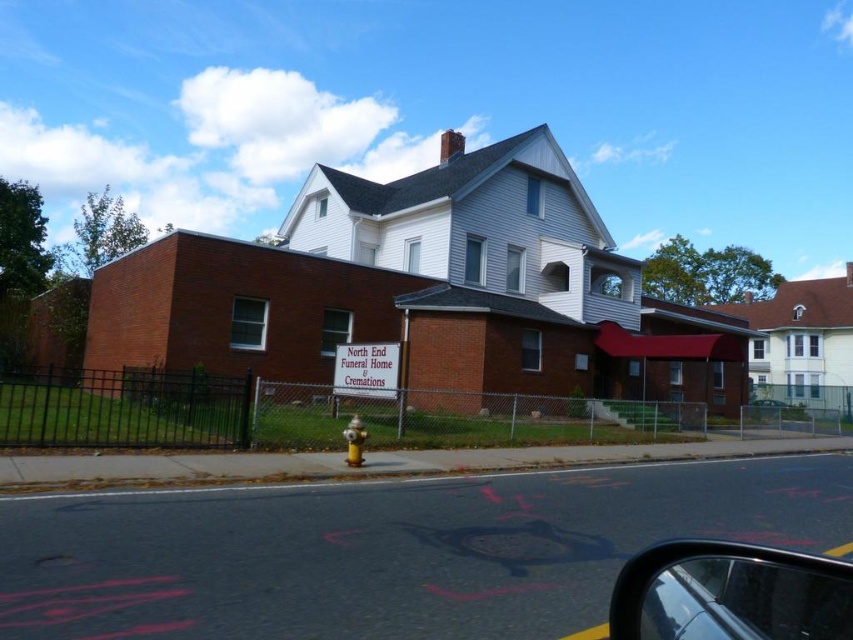
Is white plastic sign at center shorter than metallic silver car at center?

Yes, white plastic sign at center is shorter than metallic silver car at center.

Does white plastic sign at center appear over metallic silver car at center?

Indeed, white plastic sign at center is positioned over metallic silver car at center.

Does point (335, 394) lie behind point (801, 413)?

No, it is not.

You are a GUI agent. You are given a task and a screenshot of the screen. Output one action in this format:
    pyautogui.click(x=<x>, y=<y>)
    Task: Click on the white plastic sign at center
    Image resolution: width=853 pixels, height=640 pixels.
    Given the screenshot: What is the action you would take?
    pyautogui.click(x=366, y=369)

Does metallic silver car at center come in front of yellow metallic hydrant at lower center?

No, metallic silver car at center is further to the viewer.

Can you confirm if metallic silver car at center is smaller than yellow metallic hydrant at lower center?

Incorrect, metallic silver car at center is not smaller in size than yellow metallic hydrant at lower center.

Find the location of a particular element. The width and height of the screenshot is (853, 640). metallic silver car at center is located at coordinates (775, 410).

Is white plastic sign at center bigger than yellow metallic hydrant at lower center?

Yes, white plastic sign at center is bigger than yellow metallic hydrant at lower center.

Which is more to the right, white plastic sign at center or yellow metallic hydrant at lower center?

yellow metallic hydrant at lower center is more to the right.

Between point (345, 392) and point (347, 440), which one is positioned behind?

Point (345, 392)

What are the coordinates of `white plastic sign at center` in the screenshot? It's located at (366, 369).